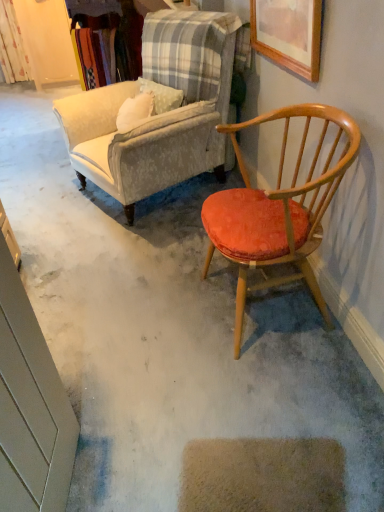
Where is `free space in front of wooden armchair with orange cushion at right, positioned as the 1th chair in front-to-back order`? free space in front of wooden armchair with orange cushion at right, positioned as the 1th chair in front-to-back order is located at coordinates (275, 406).